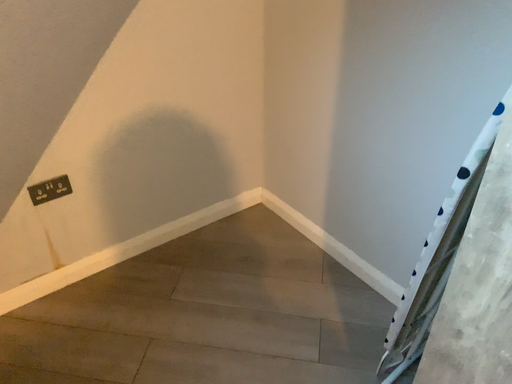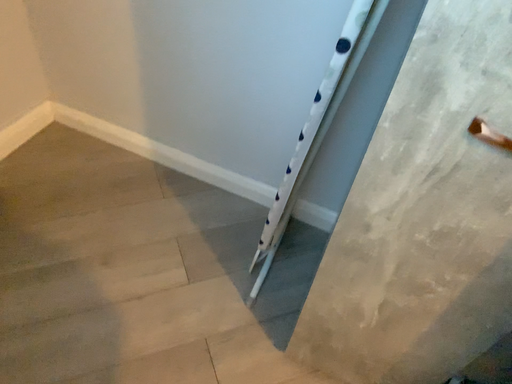
Question: How did the camera likely rotate when shooting the video?

Choices:
 (A) rotated upward
 (B) rotated downward

Answer: (B)